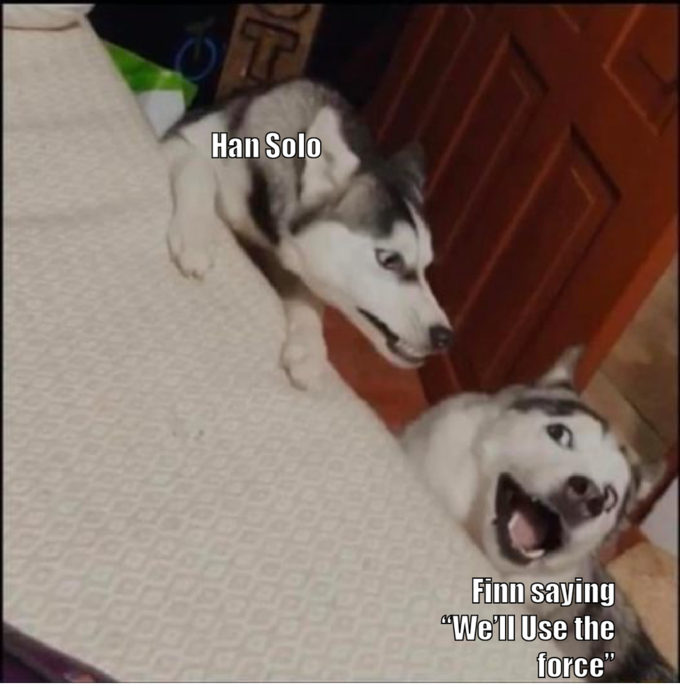
In order to click on brown door in this screenshot , I will do `click(494, 225)`.